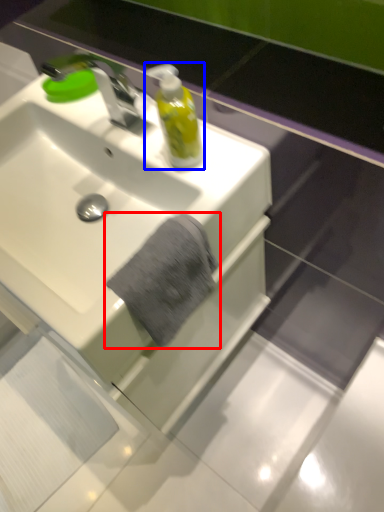
Question: Which point is further to the camera, bath towel (highlighted by a red box) or mouthwash (highlighted by a blue box)?

Choices:
 (A) bath towel
 (B) mouthwash

Answer: (B)